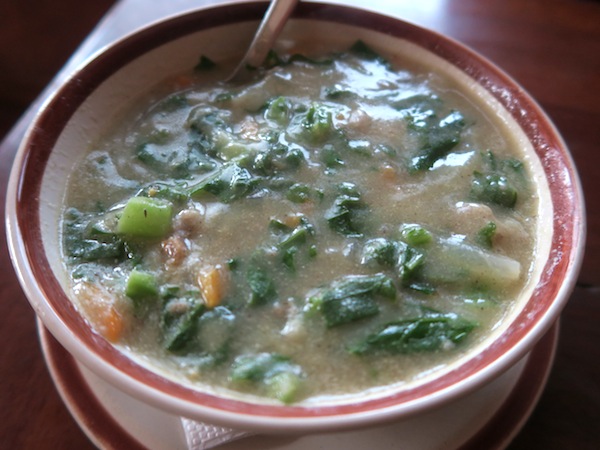
You are a GUI agent. You are given a task and a screenshot of the screen. Output one action in this format:
    pyautogui.click(x=<x>, y=<y>)
    Task: Click on the tissue
    
    Given the screenshot: What is the action you would take?
    pyautogui.click(x=193, y=433)